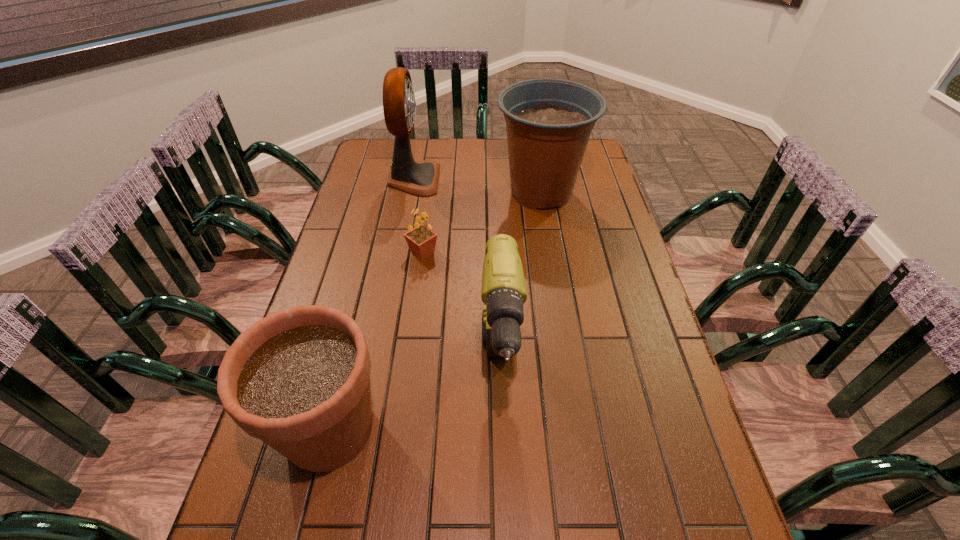
Locate which object is the third closest to the farther flowerpot. Please provide its 2D coordinates. Your answer should be formatted as a tuple, i.e. [(x, y)], where the tuple contains the x and y coordinates of a point satisfying the conditions above.

[(503, 292)]

Where is `object identified as the closest to the shorter flowerpot`? This screenshot has width=960, height=540. object identified as the closest to the shorter flowerpot is located at coordinates (503, 292).

Locate an element on the screen. Image resolution: width=960 pixels, height=540 pixels. vacant position in the image that satisfies the following two spatial constraints: 1. on the front-facing side of the tallest object; 2. on the front side of the left flowerpot is located at coordinates (368, 429).

At what (x,y) coordinates should I click in order to perform the action: click on free spot that satisfies the following two spatial constraints: 1. at the front of the third farthest object with flowers visible; 2. on the front side of the left flowerpot. Please return your answer as a coordinate pair (x, y). The image size is (960, 540). Looking at the image, I should click on (399, 429).

At what (x,y) coordinates should I click in order to perform the action: click on vacant space that satisfies the following two spatial constraints: 1. at the front of the sunflower with flowers visible; 2. on the front side of the nearer flowerpot. Please return your answer as a coordinate pair (x, y). Looking at the image, I should click on (399, 429).

Find the location of a particular element. Image resolution: width=960 pixels, height=540 pixels. vacant region that satisfies the following two spatial constraints: 1. on the back side of the taller flowerpot; 2. on the front-facing side of the fan is located at coordinates (539, 179).